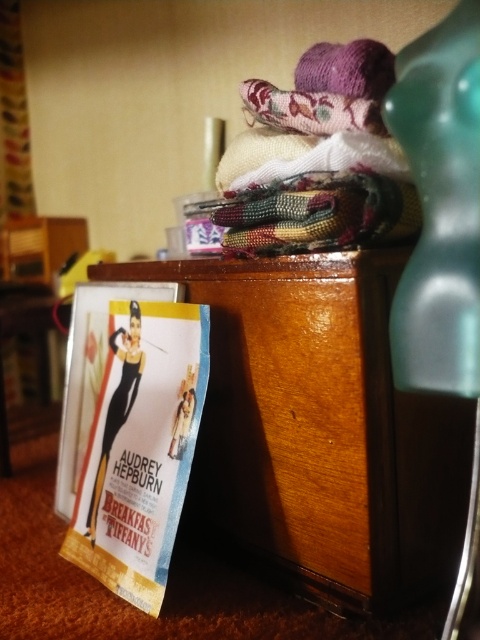
Can you confirm if wooden dresser at lower left is positioned above matte paper poster at lower left?

Yes.

Is wooden dresser at lower left positioned behind matte paper poster at lower left?

No, wooden dresser at lower left is in front of matte paper poster at lower left.

Is point (160, 264) closer to camera compared to point (132, 349)?

No, it is behind (132, 349).

The width and height of the screenshot is (480, 640). What are the coordinates of `wooden dresser at lower left` in the screenshot? It's located at (320, 429).